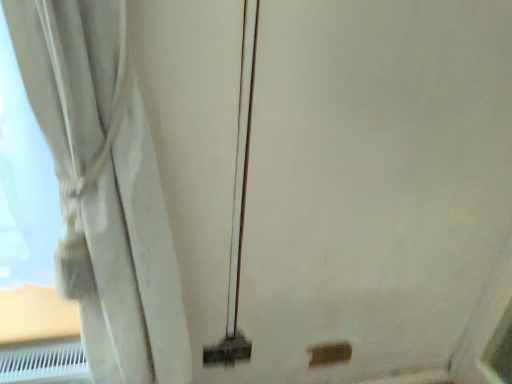
The height and width of the screenshot is (384, 512). I want to click on white fabric curtain at left, so coord(104,188).

What do you see at coordinates (104, 188) in the screenshot? The height and width of the screenshot is (384, 512). I see `white fabric curtain at left` at bounding box center [104, 188].

At what (x,y) coordinates should I click in order to perform the action: click on white fabric curtain at left. Please return your answer as a coordinate pair (x, y). This screenshot has height=384, width=512. Looking at the image, I should click on (104, 188).